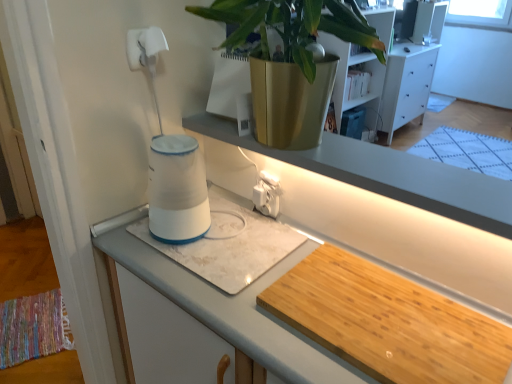
Question: In the image, is white laminate cabinet at center on the left side or the right side of white glossy water heater at center?

Choices:
 (A) left
 (B) right

Answer: (B)

Question: From a real-world perspective, relative to white glossy water heater at center, is white laminate cabinet at center vertically above or below?

Choices:
 (A) above
 (B) below

Answer: (B)

Question: Based on their relative distances, which object is farther from the white glossy water heater at center?

Choices:
 (A) wooden cutting board at lower right, which ranks as the 1th wide in right-to-left order
 (B) white glossy dresser at upper right
 (C) white glossy cup at center, which is counted as the 1th wide, starting from the left
 (D) white plastic electric outlet at center
 (E) white laminate cabinet at center

Answer: (B)

Question: Considering the real-world distances, which object is farthest from the white glossy water heater at center?

Choices:
 (A) white glossy window sill at upper center
 (B) white laminate cabinet at center
 (C) wooden cutting board at lower right, which ranks as the 1th wide in right-to-left order
 (D) white glossy dresser at upper right
 (E) white glossy cup at center, placed as the 2th wide when sorted from right to left

Answer: (D)